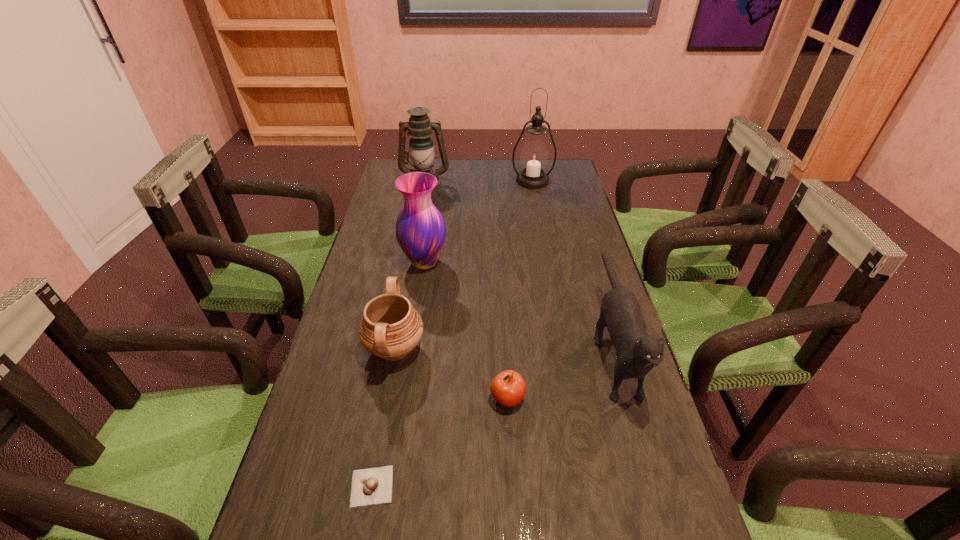
Where is `the tallest object`? The width and height of the screenshot is (960, 540). the tallest object is located at coordinates (534, 156).

At what (x,y) coordinates should I click in order to perform the action: click on the right oil lamp. Please return your answer as a coordinate pair (x, y). The image size is (960, 540). Looking at the image, I should click on (534, 156).

The width and height of the screenshot is (960, 540). I want to click on the left oil lamp, so [x=421, y=146].

The height and width of the screenshot is (540, 960). Identify the location of vase. (420, 228).

The height and width of the screenshot is (540, 960). Identify the location of the fourth tallest object. (637, 352).

The width and height of the screenshot is (960, 540). What are the coordinates of `the fifth tallest object` in the screenshot? It's located at (390, 328).

The width and height of the screenshot is (960, 540). Find the location of `apple`. apple is located at coordinates (508, 388).

Where is `the second shortest object`? The height and width of the screenshot is (540, 960). the second shortest object is located at coordinates (508, 388).

Find the location of `the shortest object`. the shortest object is located at coordinates (373, 486).

Where is `garlic`? garlic is located at coordinates tap(373, 486).